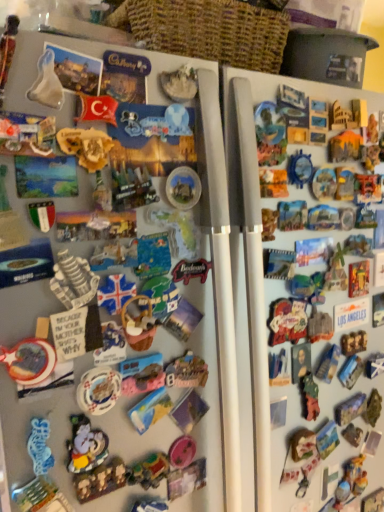
Question: From a real-world perspective, is translucent plastic toy at center, which is the sixth toy from bottom to top, on top of green matte toy at right, which appears as the 9th toy when viewed from the front?

Choices:
 (A) no
 (B) yes

Answer: (B)

Question: Considering the relative sizes of translucent plastic toy at center, the fifth toy from the right, and green matte toy at right, the second toy from the back, in the image provided, is translucent plastic toy at center, the fifth toy from the right, taller than green matte toy at right, the second toy from the back,?

Choices:
 (A) yes
 (B) no

Answer: (B)

Question: Considering the relative positions of translucent plastic toy at center, which is the sixth toy from bottom to top, and green matte toy at right, marked as the 4th toy in a bottom-to-top arrangement, in the image provided, is translucent plastic toy at center, which is the sixth toy from bottom to top, behind green matte toy at right, marked as the 4th toy in a bottom-to-top arrangement,?

Choices:
 (A) yes
 (B) no

Answer: (B)

Question: From a real-world perspective, is translucent plastic toy at center, which is the 7th toy from front to back, located beneath green matte toy at right, which appears as the 9th toy when viewed from the front?

Choices:
 (A) no
 (B) yes

Answer: (A)

Question: From the image's perspective, is translucent plastic toy at center, which is the sixth toy from bottom to top, over green matte toy at right, placed as the 7th toy when sorted from top to bottom?

Choices:
 (A) yes
 (B) no

Answer: (A)

Question: Based on their sizes in the image, would you say green matte toy at right, marked as the 4th toy in a bottom-to-top arrangement, is bigger or smaller than white marble statue at center, the third toy viewed from the right?

Choices:
 (A) small
 (B) big

Answer: (B)

Question: In the image, is green matte toy at right, which appears as the second toy when viewed from the right, positioned in front of or behind white marble statue at center, arranged as the tenth toy when ordered from the bottom?

Choices:
 (A) front
 (B) behind

Answer: (B)

Question: From a real-world perspective, is green matte toy at right, the second toy from the back, positioned above or below white marble statue at center, the third toy viewed from the right?

Choices:
 (A) above
 (B) below

Answer: (B)

Question: In terms of height, does green matte toy at right, which appears as the 9th toy when viewed from the front, look taller or shorter compared to white marble statue at center, which ranks as the 5th toy in back-to-front order?

Choices:
 (A) short
 (B) tall

Answer: (B)

Question: Choose the correct answer: Is matte plastic button at right inside translucent plastic toy at center, placed as the 4th toy when sorted from back to front, or outside it?

Choices:
 (A) inside
 (B) outside

Answer: (B)

Question: Looking at the image, does matte plastic button at right seem bigger or smaller compared to translucent plastic toy at center, which ranks as the fifth toy in top-to-bottom order?

Choices:
 (A) small
 (B) big

Answer: (A)

Question: Is point (337, 322) closer or farther from the camera than point (155, 414)?

Choices:
 (A) farther
 (B) closer

Answer: (A)

Question: From a real-world perspective, is matte plastic button at right physically located above or below translucent plastic toy at center, which ranks as the fifth toy in top-to-bottom order?

Choices:
 (A) above
 (B) below

Answer: (A)

Question: From the image's perspective, is matte plastic magnet at upper left, which is counted as the ninth toy, starting from the bottom, located above or below matte plastic button at right?

Choices:
 (A) below
 (B) above

Answer: (B)

Question: In terms of width, does matte plastic magnet at upper left, which appears as the first toy when viewed from the left, look wider or thinner when compared to matte plastic button at right?

Choices:
 (A) thin
 (B) wide

Answer: (B)